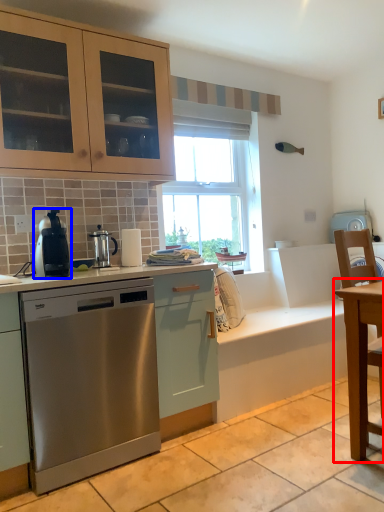
Question: Which point is further to the camera, table (highlighted by a red box) or home appliance (highlighted by a blue box)?

Choices:
 (A) table
 (B) home appliance

Answer: (B)